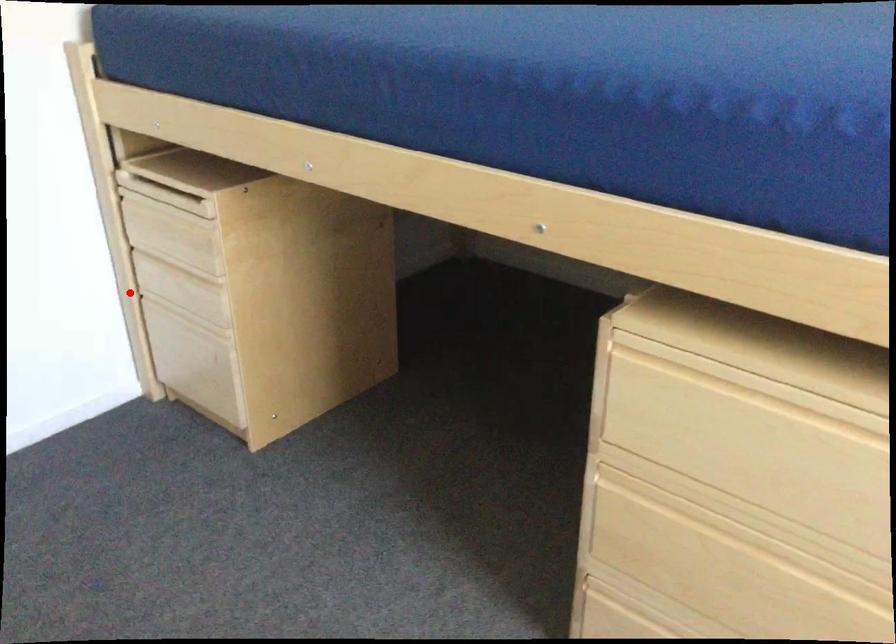
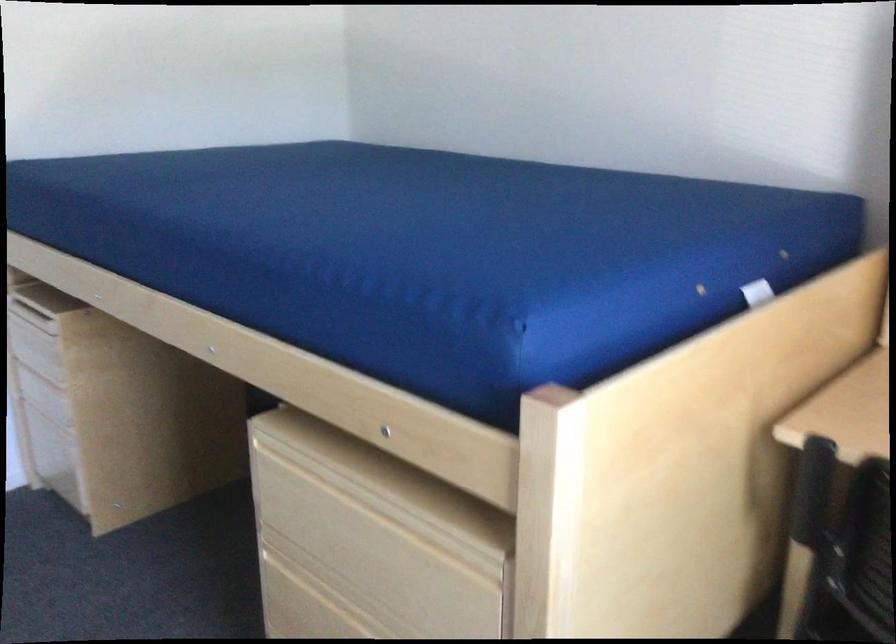
Question: I am providing you with two images of the same scene from different viewpoints. A red point is marked on the first image. Is the red point's position out of view in image 2?

Choices:
 (A) Yes
 (B) No

Answer: (B)